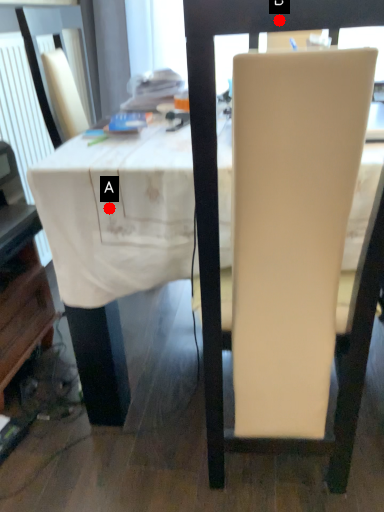
Question: Two points are circled on the image, labeled by A and B beside each circle. Which point appears closest to the camera in this image?

Choices:
 (A) A is closer
 (B) B is closer

Answer: (B)